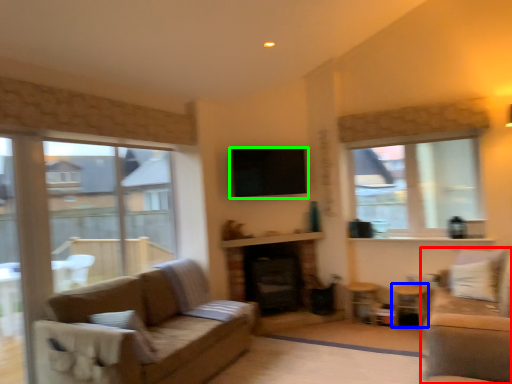
Question: Which object is positioned farthest from studio couch (highlighted by a red box)? Select from side table (highlighted by a blue box) and window screen (highlighted by a green box).

Choices:
 (A) side table
 (B) window screen

Answer: (B)